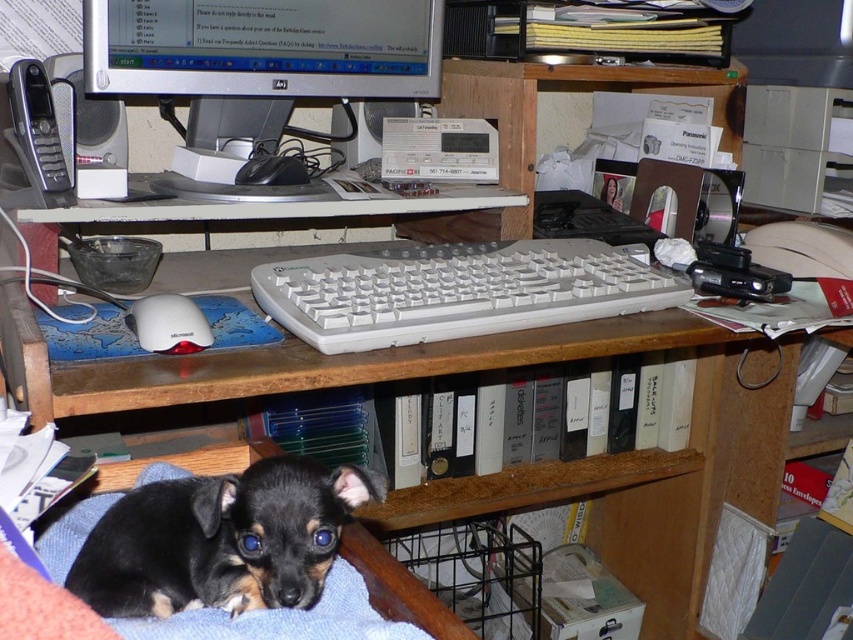
Is matte black monitor at upper center smaller than white plastic keyboard at center?

Indeed, matte black monitor at upper center has a smaller size compared to white plastic keyboard at center.

Who is more distant from viewer, [132,76] or [486,275]?

Positioned behind is point [132,76].

Is point (206, 72) positioned behind point (418, 252)?

Yes, point (206, 72) is farther from viewer.

Locate an element on the screen. matte black monitor at upper center is located at coordinates (263, 48).

Is point (224, 545) farther from viewer compared to point (465, 278)?

No, (224, 545) is closer to viewer.

Can you confirm if black fur dog at lower left is positioned below white plastic keyboard at center?

Yes.

Where is `black fur dog at lower left`? The height and width of the screenshot is (640, 853). black fur dog at lower left is located at coordinates point(221,540).

I want to click on black fur dog at lower left, so click(221, 540).

Is point (166, 577) farther from camera compared to point (289, 17)?

No, it is not.

Does black fur dog at lower left appear under matte black monitor at upper center?

Correct, black fur dog at lower left is located below matte black monitor at upper center.

This screenshot has height=640, width=853. I want to click on black fur dog at lower left, so click(x=221, y=540).